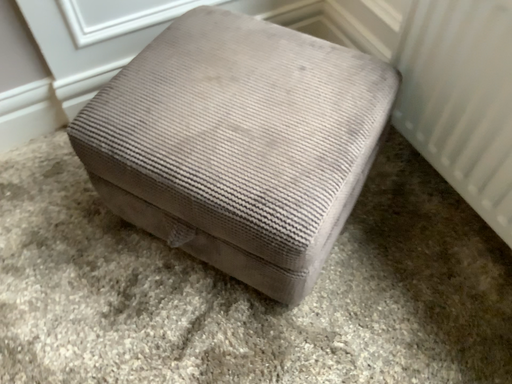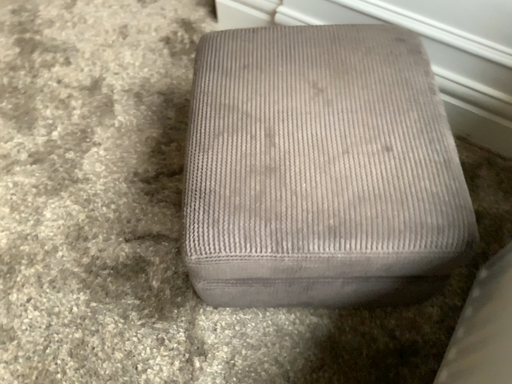
Question: How did the camera likely rotate when shooting the video?

Choices:
 (A) rotated left
 (B) rotated right

Answer: (A)